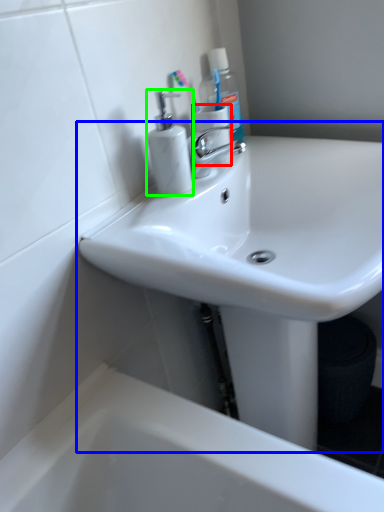
Question: Which is nearer to the toilet paper (highlighted by a red box)? sink (highlighted by a blue box) or soap dispenser (highlighted by a green box).

Choices:
 (A) sink
 (B) soap dispenser

Answer: (B)